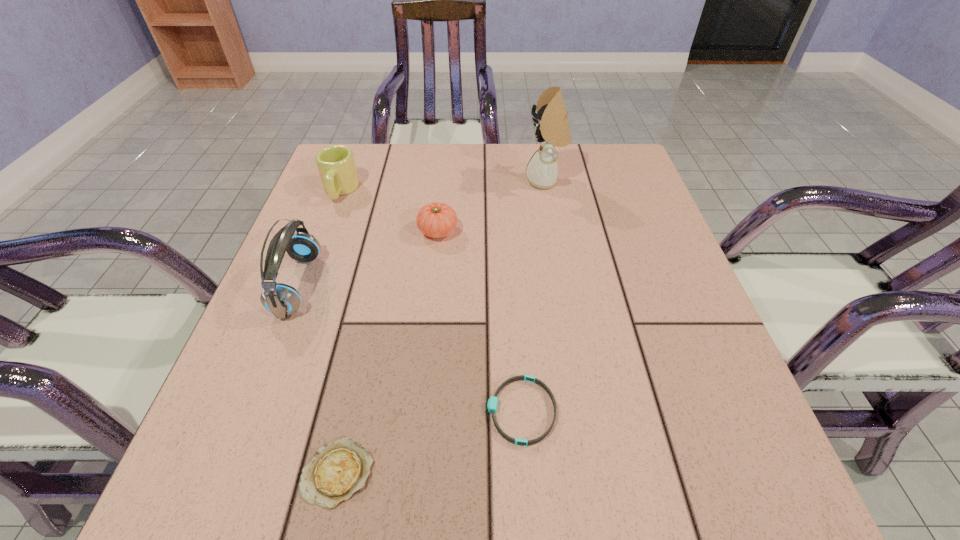
Where is `vacant area situated at the front face of the tallest object`? The height and width of the screenshot is (540, 960). vacant area situated at the front face of the tallest object is located at coordinates (412, 181).

Where is `vacant space located at the front face of the tallest object`? vacant space located at the front face of the tallest object is located at coordinates (412, 181).

Where is `vacant space located on the ear cups of the third nearest object`? Image resolution: width=960 pixels, height=540 pixels. vacant space located on the ear cups of the third nearest object is located at coordinates (381, 285).

This screenshot has height=540, width=960. What are the coordinates of `vacant space located with the handle on the side of the fourth shortest object` in the screenshot? It's located at (326, 227).

I want to click on free space located on the right of the third object from right to left, so click(552, 231).

Identify the location of vacant space located on the buckle of the wristband. Image resolution: width=960 pixels, height=540 pixels. (326, 411).

Find the location of `vacant space situated 0.190m on the buckle of the wristband`. vacant space situated 0.190m on the buckle of the wristband is located at coordinates point(365,411).

In order to click on vacant region located on the buckle of the wristband in this screenshot , I will do (x=358, y=411).

Image resolution: width=960 pixels, height=540 pixels. Find the location of `free location located on the right of the third object from left to right`. free location located on the right of the third object from left to right is located at coordinates (451, 472).

Where is `doll that is at the far edge`? The height and width of the screenshot is (540, 960). doll that is at the far edge is located at coordinates (552, 129).